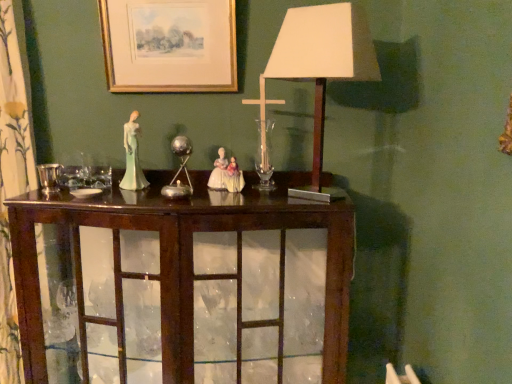
Question: From a real-world perspective, is mahogany cabinet at center physically located above or below metallic silver candle holder at center, arranged as the 2th candle holder when viewed from the left?

Choices:
 (A) below
 (B) above

Answer: (A)

Question: Is mahogany cabinet at center taller or shorter than metallic silver candle holder at center, marked as the 2th candle holder in a front-to-back arrangement?

Choices:
 (A) tall
 (B) short

Answer: (A)

Question: Which object is positioned closest to the mahogany cabinet at center?

Choices:
 (A) white paper lampshade at center
 (B) gold-framed print at upper center
 (C) shiny silver candle holder at left, the first candle holder viewed from the left
 (D) metallic silver candle holder at center, marked as the 2th candle holder in a front-to-back arrangement
 (E) porcelain figure at center

Answer: (D)

Question: Which object is the closest to the white paper lampshade at center?

Choices:
 (A) gold-framed print at upper center
 (B) mahogany cabinet at center
 (C) metallic silver candle holder at center, positioned as the first candle holder in back-to-front order
 (D) porcelain figure at center
 (E) shiny silver candle holder at left, marked as the second candle holder in a back-to-front arrangement

Answer: (A)